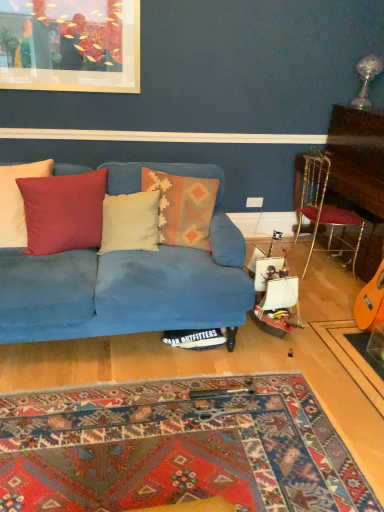
Question: From a real-world perspective, is matte red cushion at center, which ranks as the third pillow in right-to-left order, physically located above or below white plastic power outlet at upper right?

Choices:
 (A) above
 (B) below

Answer: (A)

Question: From the image's perspective, relative to white plastic power outlet at upper right, is matte red cushion at center, which ranks as the third pillow in right-to-left order, above or below?

Choices:
 (A) above
 (B) below

Answer: (B)

Question: Which is farther from the creamy soft pillow at center, arranged as the 2th pillow when viewed from the right?

Choices:
 (A) textured woolen pillow at center, positioned as the fourth pillow in left-to-right order
 (B) matte red cushion at center, which ranks as the third pillow in right-to-left order
 (C) velvet blue couch at center
 (D) matte red cushion at left, positioned as the first pillow in left-to-right order
 (E) white plastic power outlet at upper right

Answer: (E)

Question: Which object is positioned closest to the white plastic power outlet at upper right?

Choices:
 (A) creamy soft pillow at center, marked as the 3th pillow in a left-to-right arrangement
 (B) velvet blue couch at center
 (C) textured woolen pillow at center, arranged as the 1th pillow when viewed from the right
 (D) matte red cushion at left, positioned as the 4th pillow in right-to-left order
 (E) matte red cushion at center, which ranks as the third pillow in right-to-left order

Answer: (C)